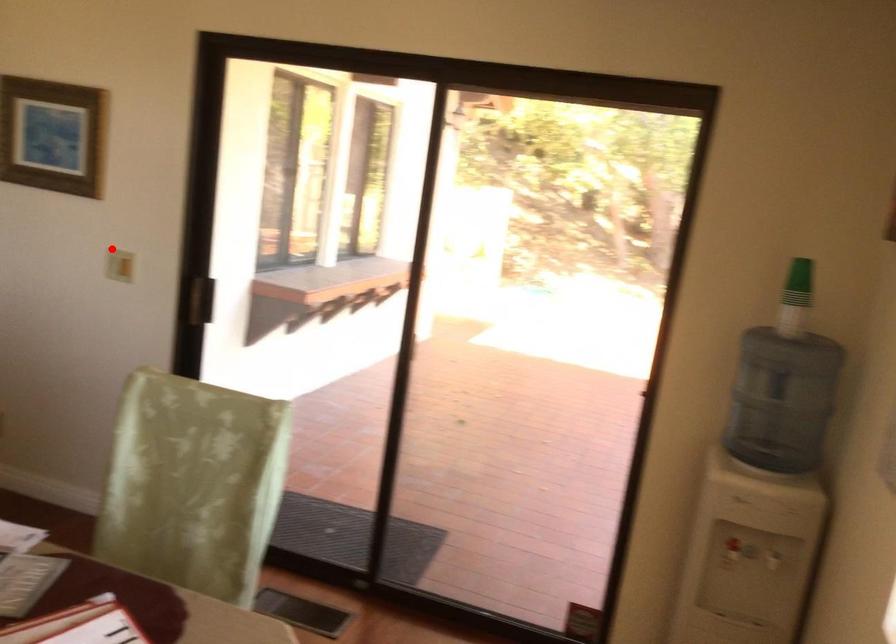
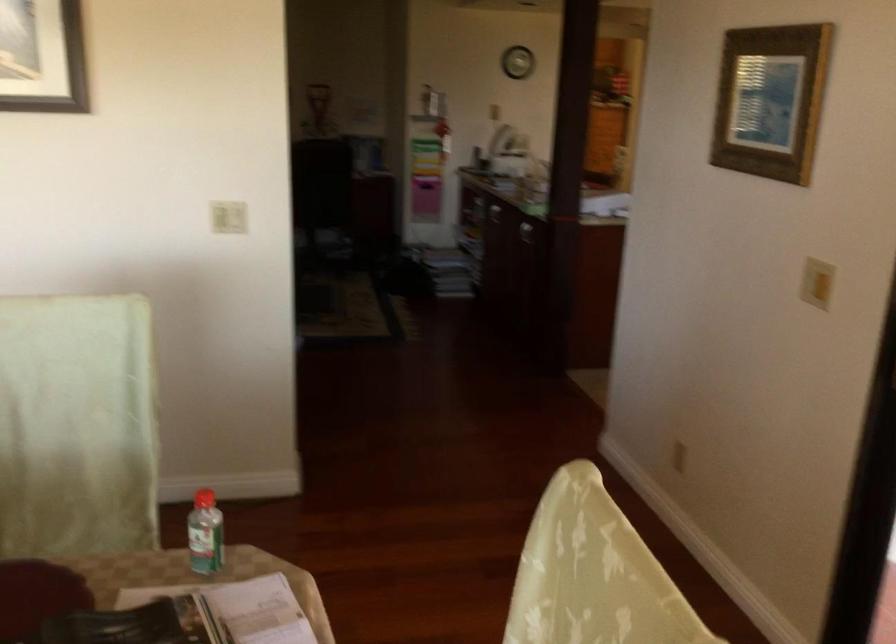
Find the pixel in the second image that matches the highlighted location in the first image.

(816, 283)